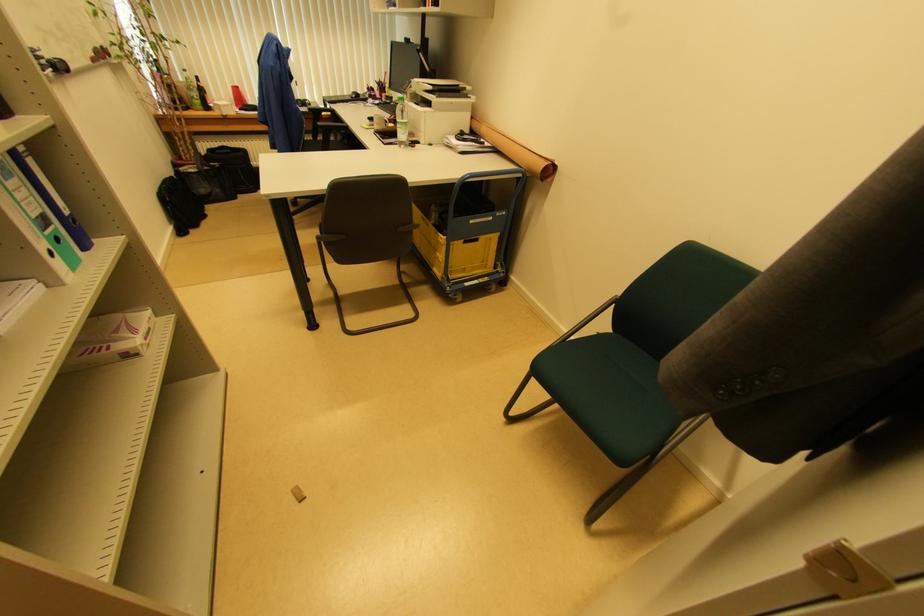
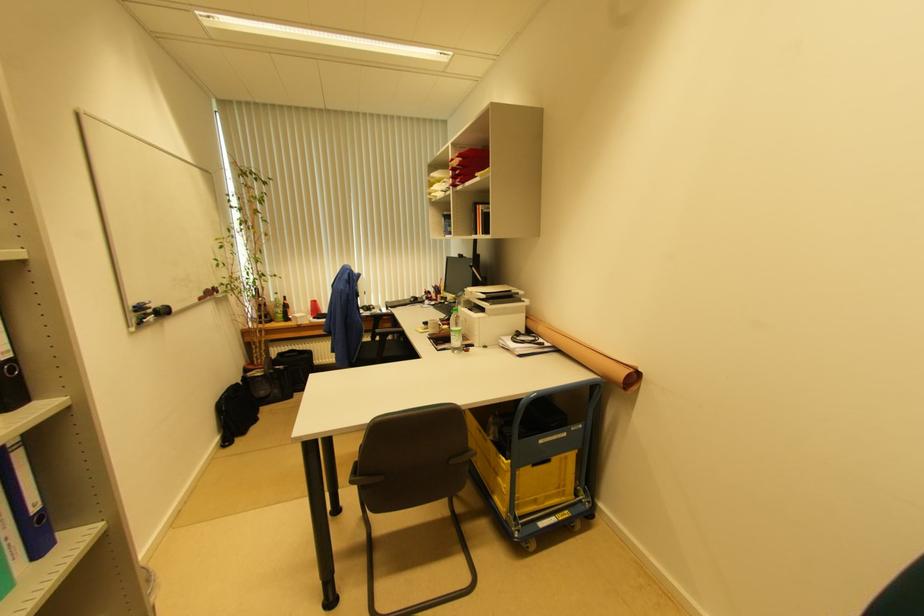
In the second image, find the point that corresponds to point (176, 177) in the first image.

(242, 383)